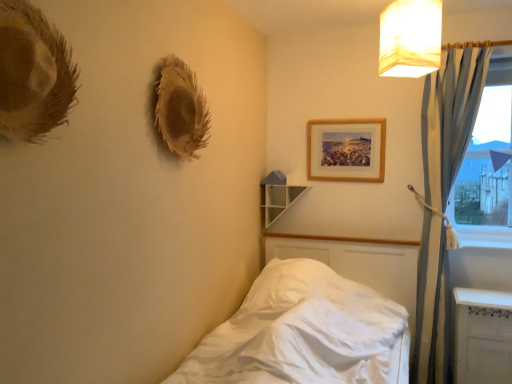
Question: Is white fabric lampshade at upper right smaller than wooden picture frame at upper center?

Choices:
 (A) yes
 (B) no

Answer: (B)

Question: Is the surface of white fabric lampshade at upper right in direct contact with wooden picture frame at upper center?

Choices:
 (A) no
 (B) yes

Answer: (A)

Question: Is wooden picture frame at upper center a part of white fabric lampshade at upper right?

Choices:
 (A) yes
 (B) no

Answer: (B)

Question: Does white fabric lampshade at upper right have a greater height compared to wooden picture frame at upper center?

Choices:
 (A) no
 (B) yes

Answer: (A)

Question: Can you confirm if white fabric lampshade at upper right is positioned to the left of wooden picture frame at upper center?

Choices:
 (A) yes
 (B) no

Answer: (B)

Question: Is white fabric lampshade at upper right shorter than wooden picture frame at upper center?

Choices:
 (A) yes
 (B) no

Answer: (A)

Question: Considering the relative positions of transparent glass window at right and white fabric lampshade at upper right in the image provided, is transparent glass window at right in front of white fabric lampshade at upper right?

Choices:
 (A) yes
 (B) no

Answer: (B)

Question: Is transparent glass window at right thinner than white fabric lampshade at upper right?

Choices:
 (A) yes
 (B) no

Answer: (A)

Question: From a real-world perspective, is transparent glass window at right on white fabric lampshade at upper right?

Choices:
 (A) yes
 (B) no

Answer: (B)

Question: Does transparent glass window at right turn towards white fabric lampshade at upper right?

Choices:
 (A) yes
 (B) no

Answer: (B)

Question: From the image's perspective, would you say transparent glass window at right is shown under white fabric lampshade at upper right?

Choices:
 (A) no
 (B) yes

Answer: (B)

Question: Is transparent glass window at right smaller than white fabric lampshade at upper right?

Choices:
 (A) no
 (B) yes

Answer: (A)

Question: Can you confirm if blue fabric curtain at right is positioned to the left of white glossy radiator at lower right?

Choices:
 (A) yes
 (B) no

Answer: (A)